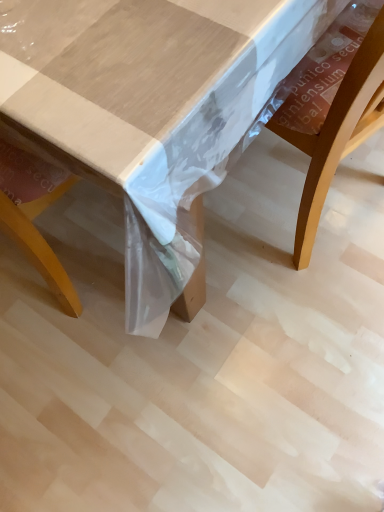
The width and height of the screenshot is (384, 512). Describe the element at coordinates (125, 70) in the screenshot. I see `wooden table at center` at that location.

This screenshot has width=384, height=512. What are the coordinates of `wooden table at center` in the screenshot? It's located at (125, 70).

Where is `wooden table at center`? wooden table at center is located at coordinates (125, 70).